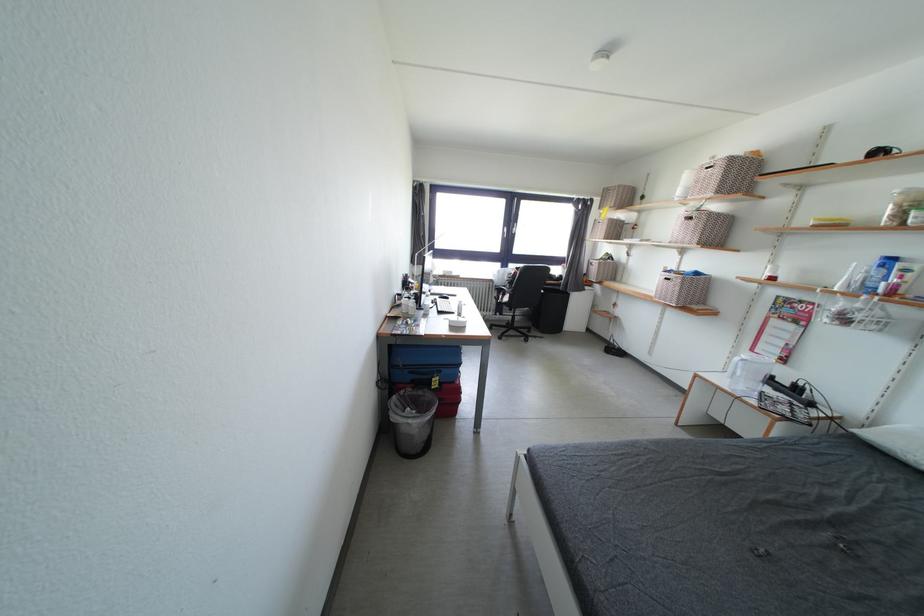
Describe the element at coordinates (428, 385) in the screenshot. I see `the patterned box handle` at that location.